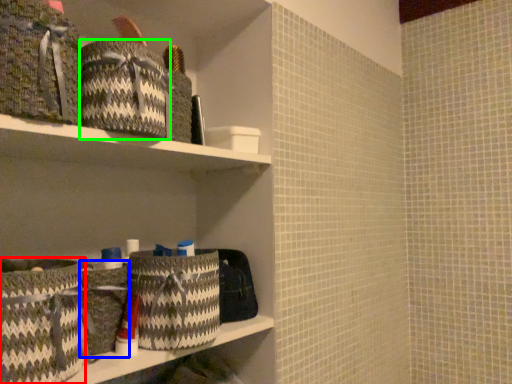
Question: Estimate the real-world distances between objects in this image. Which object is farther from basket (highlighted by a red box), basket (highlighted by a blue box) or material (highlighted by a green box)?

Choices:
 (A) basket
 (B) material

Answer: (B)